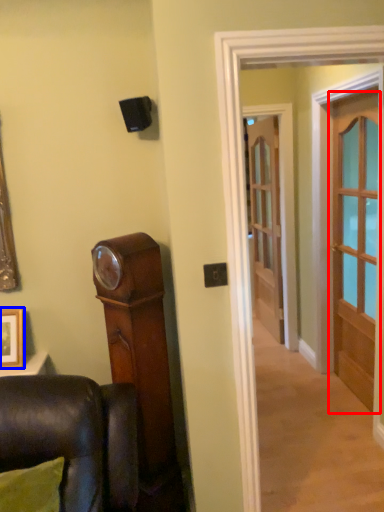
Question: Among these objects, which one is farthest to the camera, door (highlighted by a red box) or picture frame (highlighted by a blue box)?

Choices:
 (A) door
 (B) picture frame

Answer: (A)